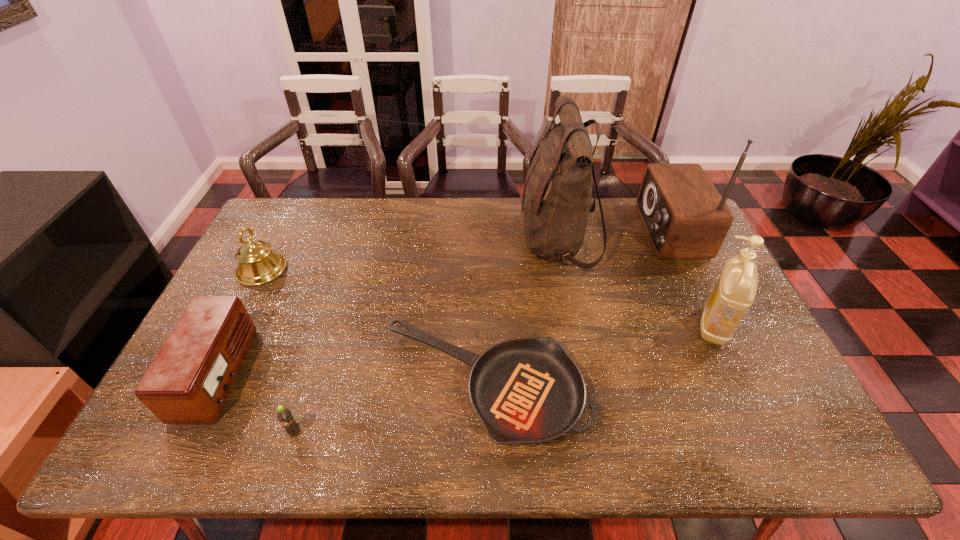
Identify the location of free location located 0.280m on the open flap of the backpack. The height and width of the screenshot is (540, 960). (437, 240).

This screenshot has height=540, width=960. What are the coordinates of `free space located on the open flap of the backpack` in the screenshot? It's located at (484, 240).

Identify the location of vacant space positioned 0.280m on the open flap of the backpack. The image size is (960, 540). (437, 240).

Find the location of `free space located on the front-facing side of the taller radio receiver`. free space located on the front-facing side of the taller radio receiver is located at coordinates (547, 230).

Where is `vacant space situated on the front-facing side of the taller radio receiver`? This screenshot has height=540, width=960. vacant space situated on the front-facing side of the taller radio receiver is located at coordinates (615, 230).

The height and width of the screenshot is (540, 960). What are the coordinates of `vacant area located 0.240m on the front-facing side of the taller radio receiver` in the screenshot? It's located at (573, 230).

At what (x,y) coordinates should I click in order to perform the action: click on free space located on the back of the fifth shortest object. Please return your answer as a coordinate pair (x, y). Looking at the image, I should click on (668, 230).

In order to click on free space located on the front of the fourth tallest object in this screenshot , I will do `click(236, 320)`.

You are a GUI agent. You are given a task and a screenshot of the screen. Output one action in this format:
    pyautogui.click(x=<x>, y=<y>)
    Task: Click on the free location located 0.240m on the front-facing side of the left radio receiver
    The height and width of the screenshot is (540, 960).
    Given the screenshot: What is the action you would take?
    pyautogui.click(x=337, y=374)

You are a GUI agent. You are given a task and a screenshot of the screen. Output one action in this format:
    pyautogui.click(x=<x>, y=<y>)
    Task: Click on the blank space located 0.100m on the left of the frying pan
    
    Given the screenshot: What is the action you would take?
    pyautogui.click(x=342, y=384)